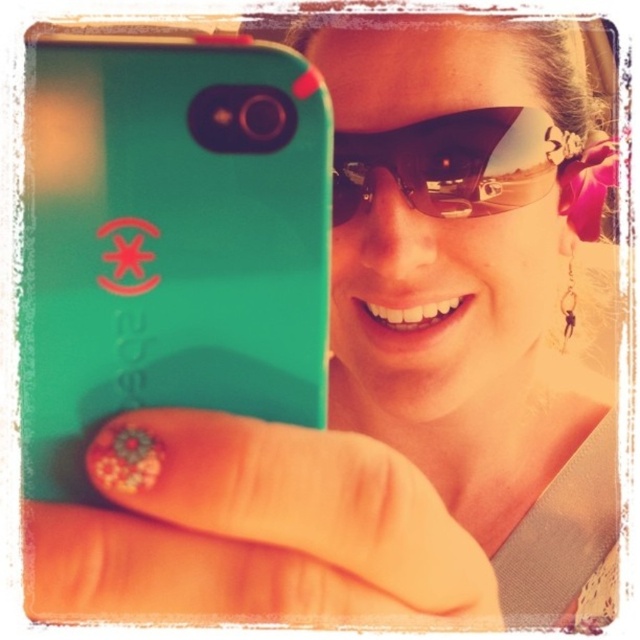
Does glittery nail art at center lie in front of brown reflective sunglasses at center?

Yes, glittery nail art at center is in front of brown reflective sunglasses at center.

Is point (305, 584) less distant than point (504, 128)?

That is True.

Does point (225, 592) come in front of point (429, 202)?

That is True.

At what (x,y) coordinates should I click in order to perform the action: click on glittery nail art at center. Please return your answer as a coordinate pair (x, y). Looking at the image, I should click on (252, 529).

Can you confirm if teal rubberized phone at center is taller than glittery nail art at center?

Correct, teal rubberized phone at center is much taller as glittery nail art at center.

Which of these two, teal rubberized phone at center or glittery nail art at center, stands taller?

With more height is teal rubberized phone at center.

Is point (262, 236) in front of point (38, 573)?

That is False.

Locate an element on the screen. The image size is (640, 640). teal rubberized phone at center is located at coordinates (168, 240).

How distant is teal rubberized phone at center from brown reflective sunglasses at center?

teal rubberized phone at center is 40.08 centimeters away from brown reflective sunglasses at center.

Is point (241, 93) positioned before point (456, 154)?

Yes, point (241, 93) is closer to viewer.

Identify the location of teal rubberized phone at center. This screenshot has width=640, height=640. (168, 240).